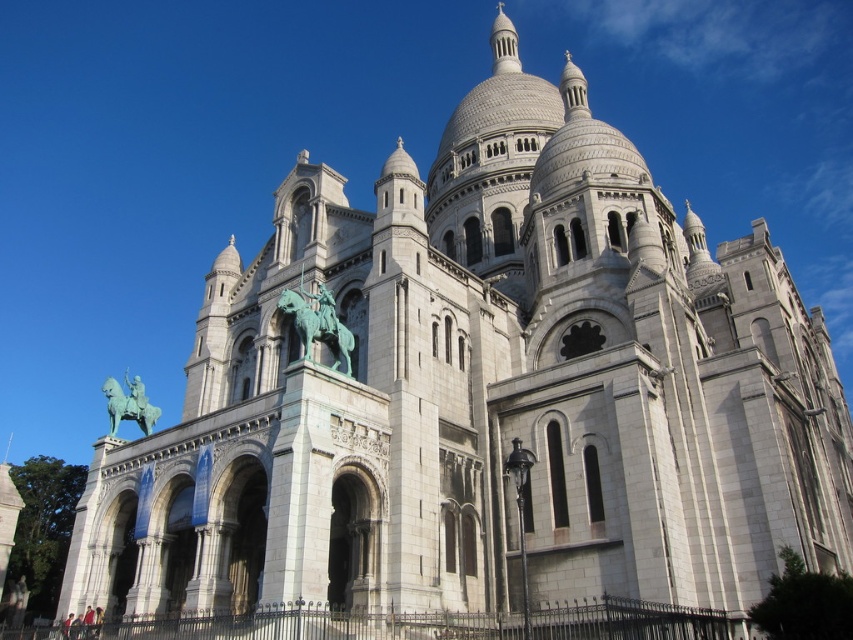
Question: Can you confirm if green patinated bronze statue of a rider at center is positioned to the right of green patina statue at center?

Choices:
 (A) yes
 (B) no

Answer: (A)

Question: Which point appears farthest from the camera in this image?

Choices:
 (A) (106, 392)
 (B) (297, 333)

Answer: (A)

Question: Among these objects, which one is nearest to the camera?

Choices:
 (A) green patina statue at center
 (B) green patinated bronze statue of a rider at center

Answer: (B)

Question: Can you confirm if green patinated bronze statue of a rider at center is wider than green patina statue at center?

Choices:
 (A) no
 (B) yes

Answer: (A)

Question: Can you confirm if green patinated bronze statue of a rider at center is bigger than green patina statue at center?

Choices:
 (A) no
 (B) yes

Answer: (A)

Question: Which point is farther from the camera taking this photo?

Choices:
 (A) (115, 420)
 (B) (299, 308)

Answer: (A)